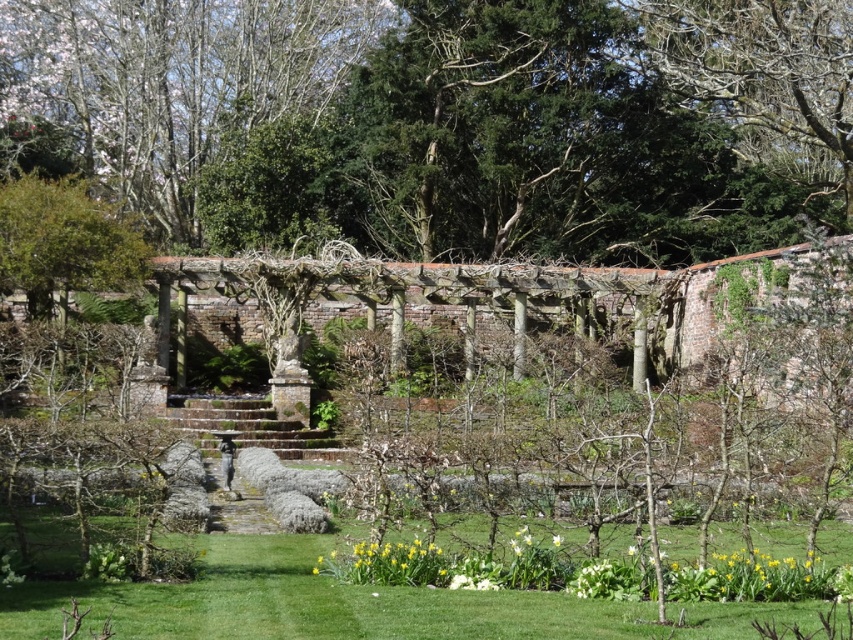
You are a gardener planning to plant a new flower bed between the smooth bark tree at upper left and the green leafy tree at upper right. Based on their positions, which tree should you start near to ensure the flower bed is centered between them?

The smooth bark tree at upper left is to the left of the green leafy tree at upper right. To center the flower bed between them, start near the smooth bark tree at upper left and measure halfway between the two trees.

You are planning to plant a new flower bed in your garden. You have a green leafy tree at upper right and a yellow matte daffodil at lower center in your current garden. Which one should you consider for shade provision if you want to plant shade loving plants?

The green leafy tree at upper right is larger in size than the yellow matte daffodil at lower center, so it would provide more shade. Therefore, you should consider the green leafy tree at upper right for shade provision when planting shade loving plants.